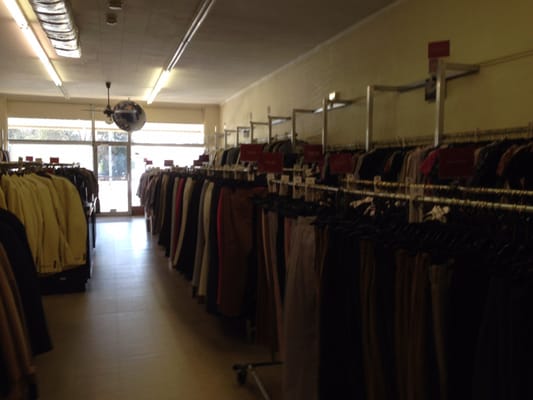
Locate an element on the screen. The width and height of the screenshot is (533, 400). fire alarm is located at coordinates (428, 49).